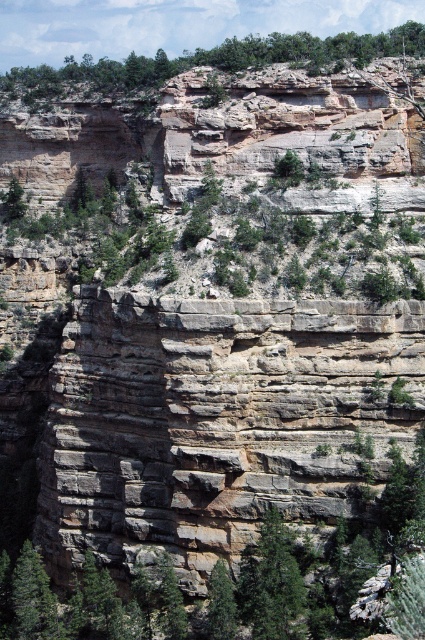
Question: Considering the real-world distances, which object is farthest from the green matte tree at lower center?

Choices:
 (A) green matte tree at center
 (B) green matte tree at lower left
 (C) green leafy tree at upper center

Answer: (C)

Question: Considering the relative positions of green leafy tree at upper center and green matte tree at center in the image provided, where is green leafy tree at upper center located with respect to green matte tree at center?

Choices:
 (A) left
 (B) right

Answer: (A)

Question: Which object appears farthest from the camera in this image?

Choices:
 (A) green matte tree at lower left
 (B) green leafy tree at upper center

Answer: (B)

Question: Is green leafy tree at upper center smaller than green matte tree at lower left?

Choices:
 (A) yes
 (B) no

Answer: (B)

Question: Estimate the real-world distances between objects in this image. Which object is closer to the green matte tree at lower center?

Choices:
 (A) green matte tree at lower left
 (B) green leafy tree at upper center

Answer: (A)

Question: Does green matte tree at center appear on the right side of green matte tree at lower center?

Choices:
 (A) yes
 (B) no

Answer: (A)